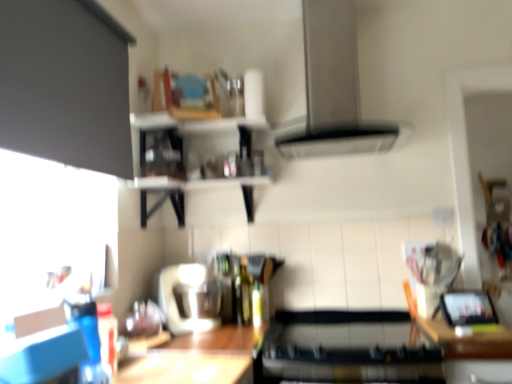
Question: Relative to green glass bottle at center, is wooden at right in front or behind?

Choices:
 (A) behind
 (B) front

Answer: (B)

Question: Considering the positions of point (485, 332) and point (238, 299), is point (485, 332) closer or farther from the camera than point (238, 299)?

Choices:
 (A) farther
 (B) closer

Answer: (B)

Question: Which object is the closest to the wooden shelves at upper center?

Choices:
 (A) matte black cabinet at upper left
 (B) wooden table at lower center
 (C) white glossy blender at center, which appears as the second appliance when viewed from the right
 (D) black matte stove at center, the first appliance when ordered from right to left
 (E) satin silver exhaust hood at upper center

Answer: (C)

Question: Which of these objects is positioned closest to the wooden at right?

Choices:
 (A) black matte stove at center, the 2th appliance viewed from the left
 (B) matte black cabinet at upper left
 (C) satin silver exhaust hood at upper center
 (D) wooden table at lower center
 (E) white glossy blender at center, which is counted as the first appliance, starting from the left

Answer: (A)